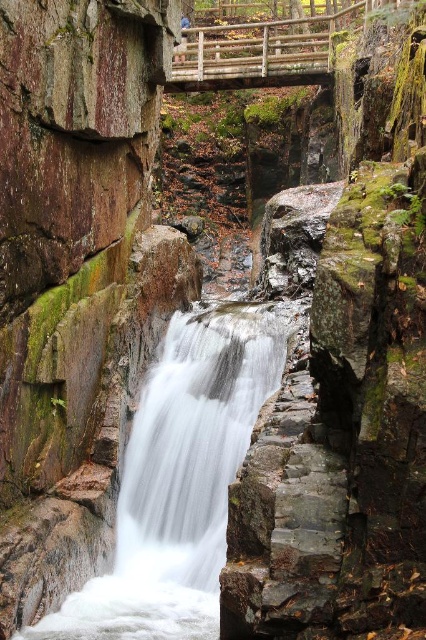
Question: Is white smooth water at center to the left of wooden bridge at upper center from the viewer's perspective?

Choices:
 (A) yes
 (B) no

Answer: (A)

Question: Can you confirm if white smooth water at center is positioned to the left of wooden bridge at upper center?

Choices:
 (A) no
 (B) yes

Answer: (B)

Question: Which object appears closest to the camera in this image?

Choices:
 (A) wooden bridge at upper center
 (B) white smooth water at center

Answer: (B)

Question: Among these objects, which one is nearest to the camera?

Choices:
 (A) white smooth water at center
 (B) wooden bridge at upper center

Answer: (A)

Question: Which point is farther to the camera?

Choices:
 (A) wooden bridge at upper center
 (B) white smooth water at center

Answer: (A)

Question: Can you confirm if white smooth water at center is thinner than wooden bridge at upper center?

Choices:
 (A) yes
 (B) no

Answer: (A)